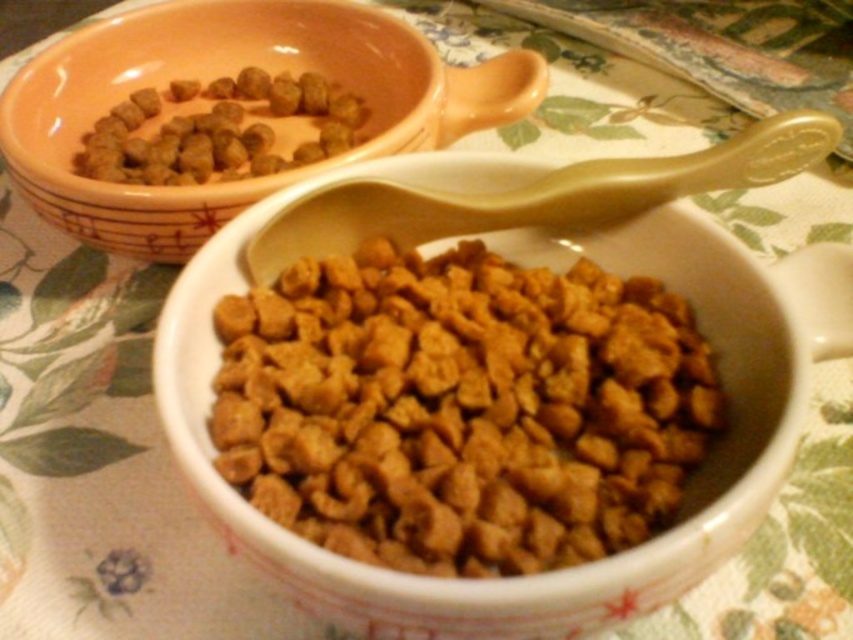
Question: Which object is closer to the camera taking this photo?

Choices:
 (A) brown matte dog food at center
 (B) matte ceramic bowl at upper left

Answer: (A)

Question: Does matte ceramic bowl at upper left appear on the left side of brown matte kibble at upper left?

Choices:
 (A) yes
 (B) no

Answer: (B)

Question: Considering the real-world distances, which object is closest to the matte ceramic bowl at upper left?

Choices:
 (A) brown matte dog food at center
 (B) brown matte kibble at upper left

Answer: (B)

Question: Which of the following is the closest to the observer?

Choices:
 (A) brown matte dog food at center
 (B) brown matte kibble at upper left

Answer: (A)

Question: Is matte ceramic bowl at upper left smaller than brown matte kibble at upper left?

Choices:
 (A) no
 (B) yes

Answer: (A)

Question: Does matte ceramic bowl at upper left have a greater width compared to brown matte kibble at upper left?

Choices:
 (A) no
 (B) yes

Answer: (B)